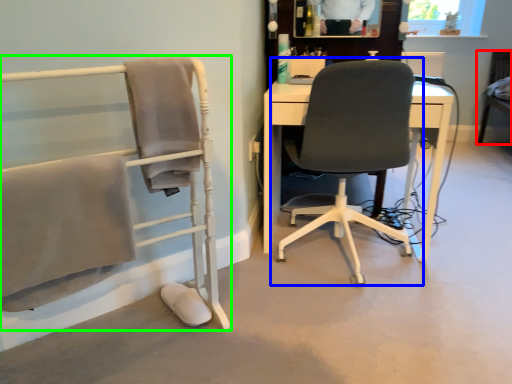
Question: Which is farther away from chair (highlighted by a red box)? chair (highlighted by a blue box) or chair (highlighted by a green box)?

Choices:
 (A) chair
 (B) chair

Answer: (B)